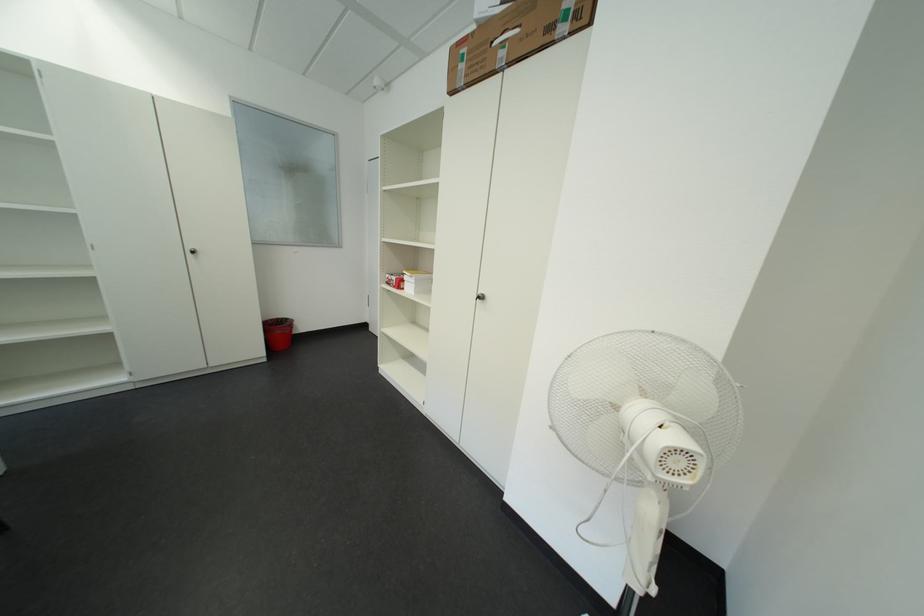
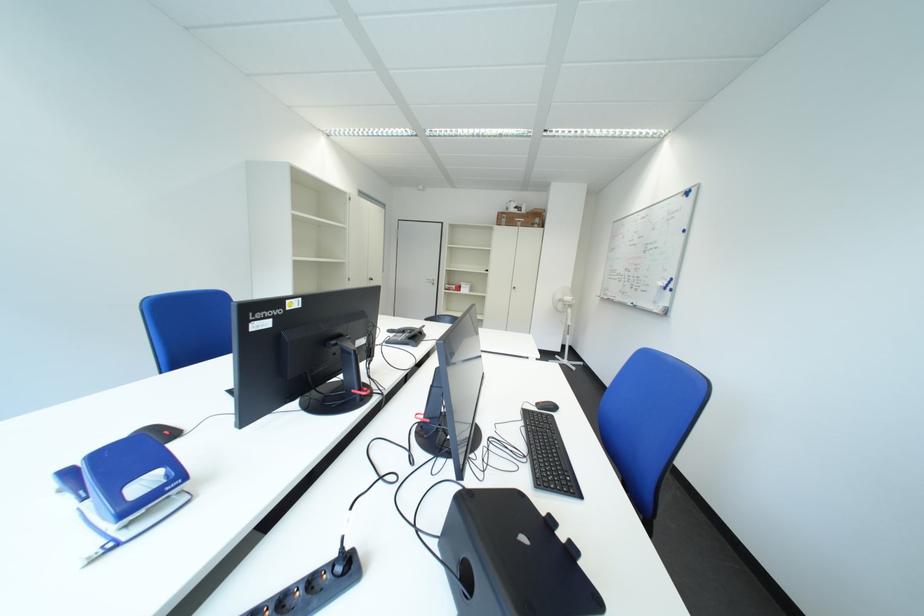
Where in the second image is the point corresponding to (x=475, y=70) from the first image?

(517, 223)